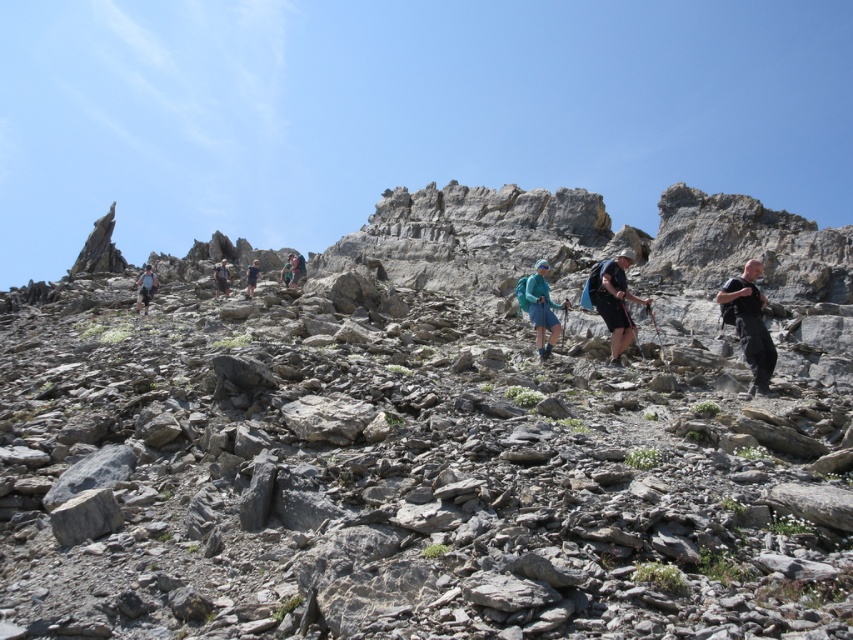
You are a hiker planning to reach the teal fabric jacket at center. The coordinates given are point (x=541, y=308). What is the location of the teal fabric jacket at center in the image?

The point (x=541, y=308) corresponds to the teal fabric jacket at center.

You are a drone operator tasked with capturing aerial footage of the hikers. You need to ensure that both the teal fabric jacket at center and the dark blue fabric backpack at upper center are in the same frame. Given that your drone camera has a maximum field of view of 50 meters, can you successfully capture both objects in a single shot?

The teal fabric jacket at center and the dark blue fabric backpack at upper center are 52.37 meters apart, which exceeds the drone camera field of view of 50 meters. Therefore, it is not possible to capture both objects in the same frame.

You are a hiker planning to move from the point at coordinates point [601,276] to the point at coordinates point [294,268]. Given that the terrain between them is rocky and uneven, which direction should you move to reach your destination?

To move from point [601,276] to point [294,268], you should move downward since point [601,276] is closer to the viewer, indicating it is higher in elevation than point [294,268].